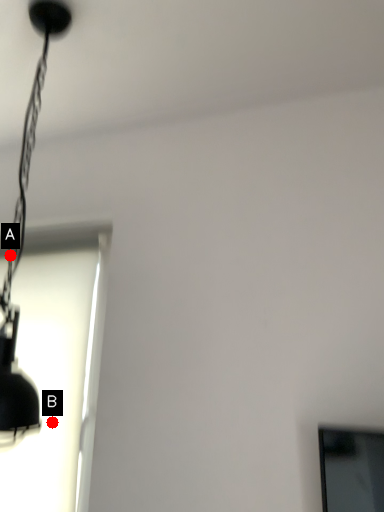
Question: Two points are circled on the image, labeled by A and B beside each circle. Which point appears farthest from the camera in this image?

Choices:
 (A) A is further
 (B) B is further

Answer: (B)